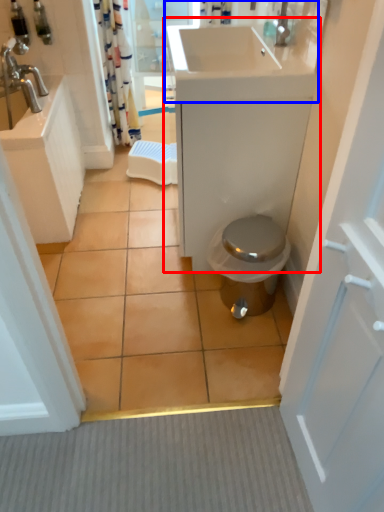
Question: Which point is further to the camera, bathroom cabinet (highlighted by a red box) or sink (highlighted by a blue box)?

Choices:
 (A) bathroom cabinet
 (B) sink

Answer: (A)